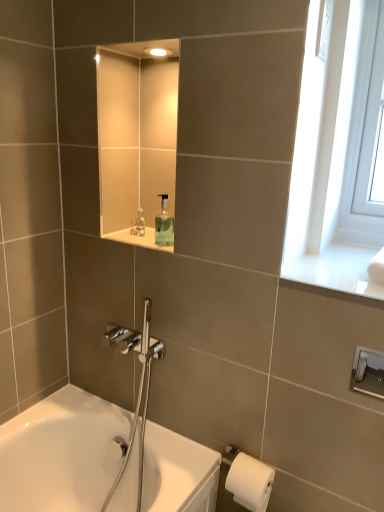
Question: Which direction should I rotate to look at translucent plastic soap dispenser at upper center?

Choices:
 (A) left
 (B) right

Answer: (A)